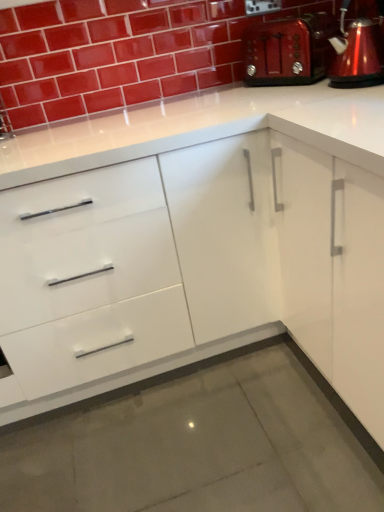
Question: Can you confirm if metallic red toaster at upper right is bigger than metallic red coffeepot at upper right?

Choices:
 (A) yes
 (B) no

Answer: (A)

Question: Considering the relative sizes of metallic red toaster at upper right and metallic red coffeepot at upper right in the image provided, is metallic red toaster at upper right smaller than metallic red coffeepot at upper right?

Choices:
 (A) yes
 (B) no

Answer: (B)

Question: Is metallic red toaster at upper right to the left of metallic red coffeepot at upper right from the viewer's perspective?

Choices:
 (A) yes
 (B) no

Answer: (A)

Question: Is metallic red coffeepot at upper right inside metallic red toaster at upper right?

Choices:
 (A) no
 (B) yes

Answer: (A)

Question: Is the surface of metallic red toaster at upper right in direct contact with metallic red coffeepot at upper right?

Choices:
 (A) yes
 (B) no

Answer: (B)

Question: Looking at the image, does metallic red coffeepot at upper right seem bigger or smaller compared to white glossy cabinet at center?

Choices:
 (A) big
 (B) small

Answer: (B)

Question: Relative to white glossy cabinet at center, is metallic red coffeepot at upper right in front or behind?

Choices:
 (A) behind
 (B) front

Answer: (A)

Question: In terms of width, does metallic red coffeepot at upper right look wider or thinner when compared to white glossy cabinet at center?

Choices:
 (A) thin
 (B) wide

Answer: (A)

Question: From a real-world perspective, is metallic red coffeepot at upper right physically located above or below white glossy cabinet at center?

Choices:
 (A) above
 (B) below

Answer: (A)

Question: From a real-world perspective, relative to glossy ceramic brick at upper center, is metallic red coffeepot at upper right vertically above or below?

Choices:
 (A) above
 (B) below

Answer: (B)

Question: In the image, is metallic red coffeepot at upper right positioned in front of or behind glossy ceramic brick at upper center?

Choices:
 (A) front
 (B) behind

Answer: (A)

Question: In terms of height, does metallic red coffeepot at upper right look taller or shorter compared to glossy ceramic brick at upper center?

Choices:
 (A) tall
 (B) short

Answer: (B)

Question: Which is correct: metallic red coffeepot at upper right is inside glossy ceramic brick at upper center, or outside of it?

Choices:
 (A) inside
 (B) outside

Answer: (B)

Question: Based on their sizes in the image, would you say glossy ceramic brick at upper center is bigger or smaller than metallic red toaster at upper right?

Choices:
 (A) big
 (B) small

Answer: (A)

Question: From the image's perspective, relative to metallic red toaster at upper right, is glossy ceramic brick at upper center above or below?

Choices:
 (A) below
 (B) above

Answer: (B)